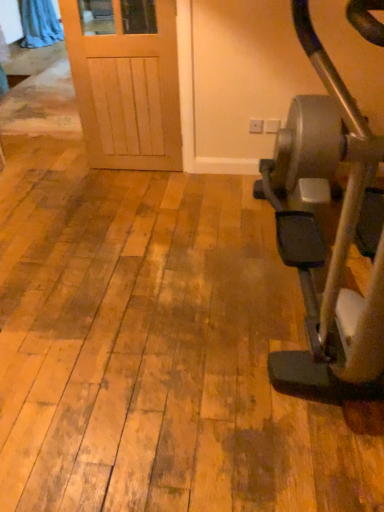
Question: Is point (357, 357) positioned closer to the camera than point (49, 11)?

Choices:
 (A) farther
 (B) closer

Answer: (B)

Question: Is metallic gray stationary bicycle at right taller or shorter than blue fabric curtain at upper left?

Choices:
 (A) tall
 (B) short

Answer: (A)

Question: In the image, is metallic gray stationary bicycle at right on the left side or the right side of blue fabric curtain at upper left?

Choices:
 (A) left
 (B) right

Answer: (B)

Question: From the image's perspective, is blue fabric curtain at upper left above or below metallic gray stationary bicycle at right?

Choices:
 (A) below
 (B) above

Answer: (B)

Question: Is point (23, 24) positioned closer to the camera than point (279, 252)?

Choices:
 (A) closer
 (B) farther

Answer: (B)

Question: Looking at their shapes, would you say blue fabric curtain at upper left is wider or thinner than metallic gray stationary bicycle at right?

Choices:
 (A) wide
 (B) thin

Answer: (B)

Question: Which is correct: blue fabric curtain at upper left is inside metallic gray stationary bicycle at right, or outside of it?

Choices:
 (A) inside
 (B) outside

Answer: (B)